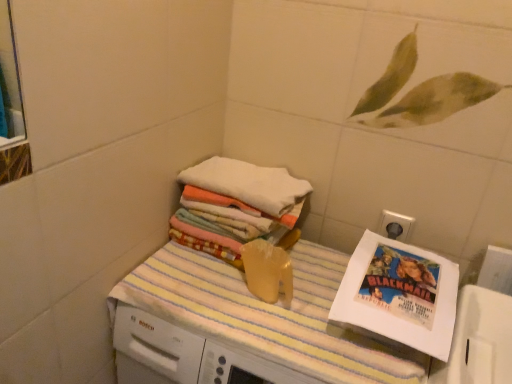
Where is `blank space situated above yellow striped towel at center (from a real-world perspective)`? blank space situated above yellow striped towel at center (from a real-world perspective) is located at coordinates (274, 294).